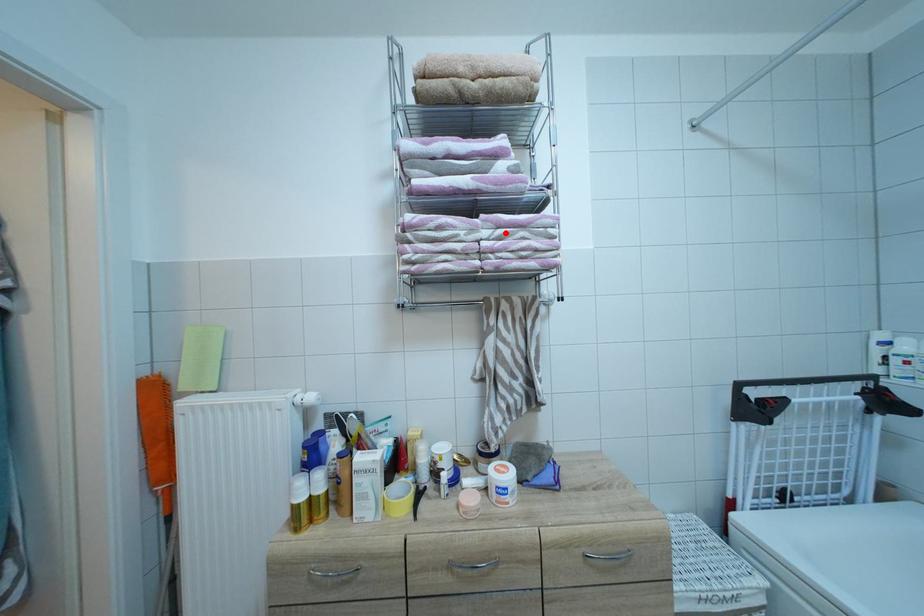
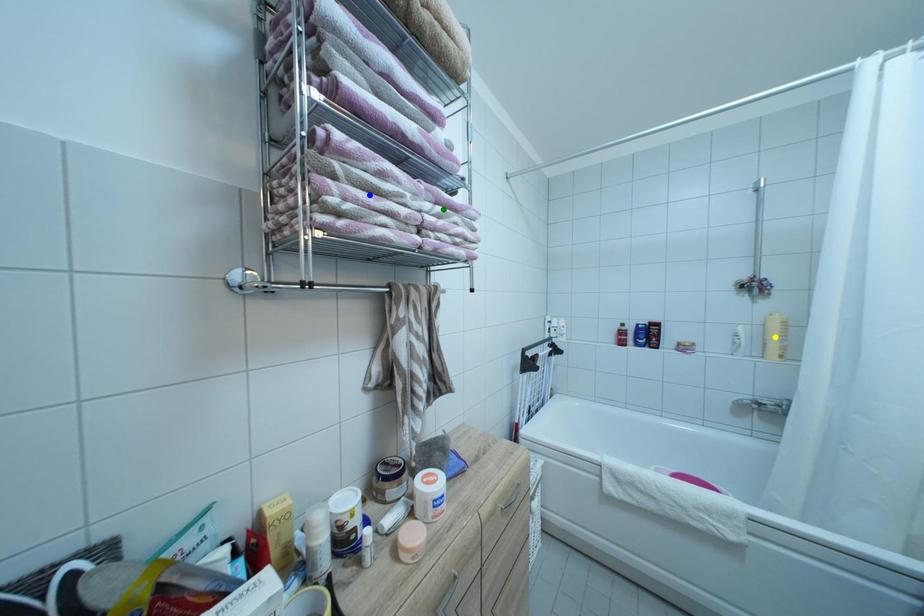
Question: I am providing you with two images of the same scene from different viewpoints. A red point is marked on the first image. You are given multiple points on the second image. Which spot in image 2 lines up with the point in image 1?

Choices:
 (A) blue point
 (B) green point
 (C) yellow point

Answer: (B)